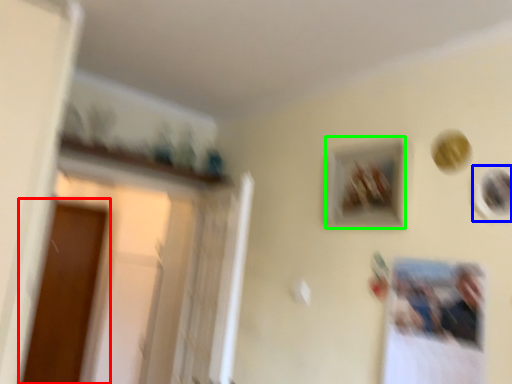
Question: Which is farther away from screen door (highlighted by a red box)? picture frame (highlighted by a blue box) or picture frame (highlighted by a green box)?

Choices:
 (A) picture frame
 (B) picture frame

Answer: (A)